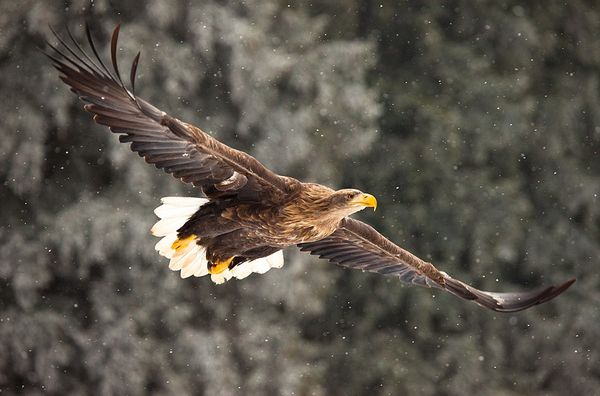
You are a GUI agent. You are given a task and a screenshot of the screen. Output one action in this format:
    pyautogui.click(x=<x>, y=<y>)
    Task: Click on the chest
    This screenshot has width=600, height=396.
    Given the screenshot: What is the action you would take?
    pyautogui.click(x=311, y=227)